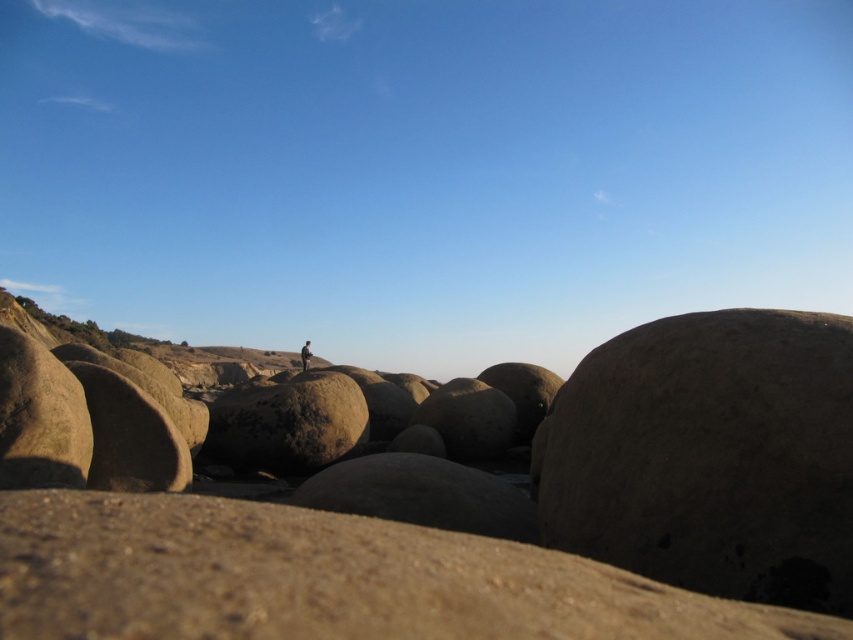
Question: Which point is closer to the camera?

Choices:
 (A) (561, 516)
 (B) (80, 602)
 (C) (840, 483)
 (D) (305, 353)

Answer: (B)

Question: Among these objects, which one is nearest to the camera?

Choices:
 (A) smooth beige sand at lower center
 (B) brown textured jacket at center
 (C) smooth sandstone rocks at center
 (D) brown rough boulder at right

Answer: (A)

Question: Can you confirm if smooth beige sand at lower center is positioned above brown textured jacket at center?

Choices:
 (A) yes
 (B) no

Answer: (A)

Question: Which point is farther to the camera?

Choices:
 (A) (161, 634)
 (B) (633, 636)
 (C) (659, 470)

Answer: (C)

Question: Is smooth sandstone rocks at center smaller than brown rough boulder at right?

Choices:
 (A) yes
 (B) no

Answer: (A)

Question: Is smooth sandstone rocks at center to the left of brown rough boulder at right from the viewer's perspective?

Choices:
 (A) no
 (B) yes

Answer: (B)